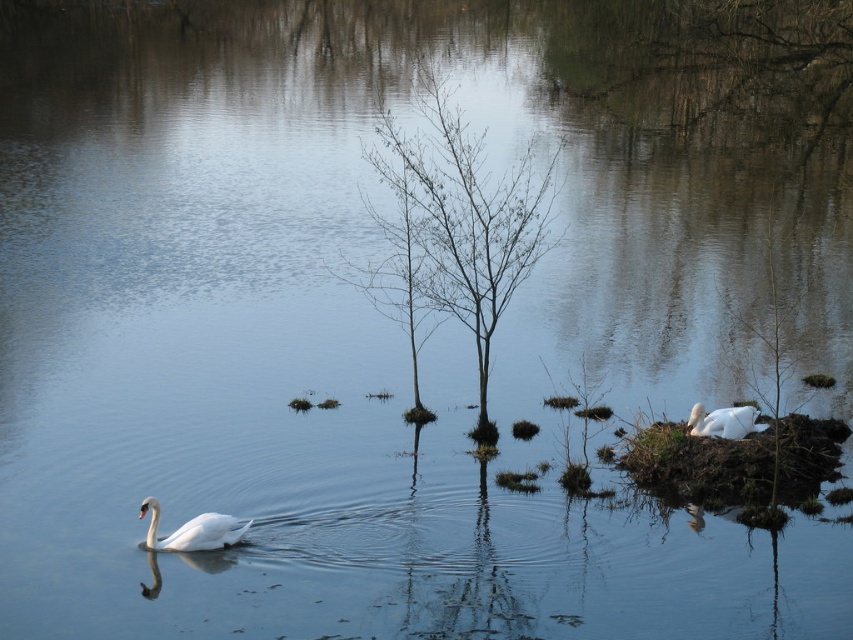
Between point (413, 285) and point (157, 506), which one is positioned behind?

Point (413, 285)

Can you confirm if bare branches at center is taller than white glossy swan at left?

Indeed, bare branches at center has a greater height compared to white glossy swan at left.

Is point (447, 131) farther from camera compared to point (178, 528)?

Yes, point (447, 131) is farther from viewer.

You are a GUI agent. You are given a task and a screenshot of the screen. Output one action in this format:
    pyautogui.click(x=<x>, y=<y>)
    Task: Click on the bare branches at center
    The height and width of the screenshot is (640, 853).
    Given the screenshot: What is the action you would take?
    pyautogui.click(x=463, y=220)

Between white glossy swan at left and white matte swan at lower right, which one appears on the left side from the viewer's perspective?

Positioned to the left is white glossy swan at left.

At what (x,y) coordinates should I click in order to perform the action: click on white glossy swan at left. Please return your answer as a coordinate pair (x, y). The image size is (853, 640). Looking at the image, I should click on (192, 531).

Who is more forward, (436, 269) or (730, 436)?

Positioned in front is point (730, 436).

Is bare branches at center positioned before white matte swan at lower right?

No, it is not.

Is point (502, 236) positioned after point (734, 410)?

Yes, it is behind point (734, 410).

Where is `bare branches at center`? The height and width of the screenshot is (640, 853). bare branches at center is located at coordinates (463, 220).